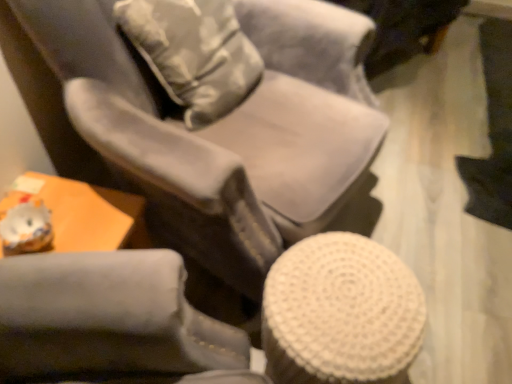
Question: Does camouflage fabric throw pillow at upper center appear on the right side of white woven stool at lower right?

Choices:
 (A) no
 (B) yes

Answer: (A)

Question: Is camouflage fabric throw pillow at upper center behind white woven stool at lower right?

Choices:
 (A) yes
 (B) no

Answer: (A)

Question: Does camouflage fabric throw pillow at upper center have a greater width compared to white woven stool at lower right?

Choices:
 (A) no
 (B) yes

Answer: (A)

Question: Is camouflage fabric throw pillow at upper center thinner than white woven stool at lower right?

Choices:
 (A) yes
 (B) no

Answer: (A)

Question: Is camouflage fabric throw pillow at upper center closer to the viewer compared to white woven stool at lower right?

Choices:
 (A) yes
 (B) no

Answer: (B)

Question: Is camouflage fabric throw pillow at upper center not inside white woven stool at lower right?

Choices:
 (A) no
 (B) yes

Answer: (B)

Question: From the image's perspective, does suede-like gray chair at center appear higher than camouflage fabric throw pillow at upper center?

Choices:
 (A) yes
 (B) no

Answer: (B)

Question: Considering the relative sizes of suede-like gray chair at center and camouflage fabric throw pillow at upper center in the image provided, is suede-like gray chair at center taller than camouflage fabric throw pillow at upper center?

Choices:
 (A) yes
 (B) no

Answer: (A)

Question: Is suede-like gray chair at center placed right next to camouflage fabric throw pillow at upper center?

Choices:
 (A) no
 (B) yes

Answer: (A)

Question: Does suede-like gray chair at center have a greater width compared to camouflage fabric throw pillow at upper center?

Choices:
 (A) yes
 (B) no

Answer: (A)

Question: From a real-world perspective, is suede-like gray chair at center physically above camouflage fabric throw pillow at upper center?

Choices:
 (A) no
 (B) yes

Answer: (A)

Question: Could you tell me if suede-like gray chair at center is turned towards camouflage fabric throw pillow at upper center?

Choices:
 (A) no
 (B) yes

Answer: (B)

Question: Does white woven stool at lower right have a larger size compared to camouflage fabric throw pillow at upper center?

Choices:
 (A) no
 (B) yes

Answer: (A)